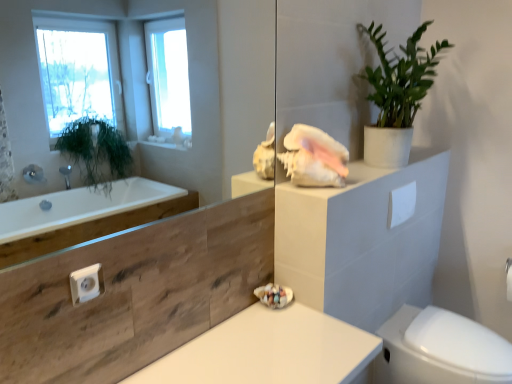
Question: Considering the positions of white glossy bidet at lower right and green matte plant at upper right in the image, is white glossy bidet at lower right taller or shorter than green matte plant at upper right?

Choices:
 (A) short
 (B) tall

Answer: (A)

Question: Does point (449, 364) appear closer or farther from the camera than point (422, 94)?

Choices:
 (A) farther
 (B) closer

Answer: (A)

Question: Which object is positioned closest to the white matte countertop at center?

Choices:
 (A) white matte toilet paper at upper right
 (B) green matte plant at upper right
 (C) white glossy bidet at lower right
 (D) transparent glass mirror at upper center

Answer: (C)

Question: Which object is the closest to the green matte plant at upper right?

Choices:
 (A) white matte countertop at center
 (B) transparent glass mirror at upper center
 (C) white matte toilet paper at upper right
 (D) white glossy bidet at lower right

Answer: (C)